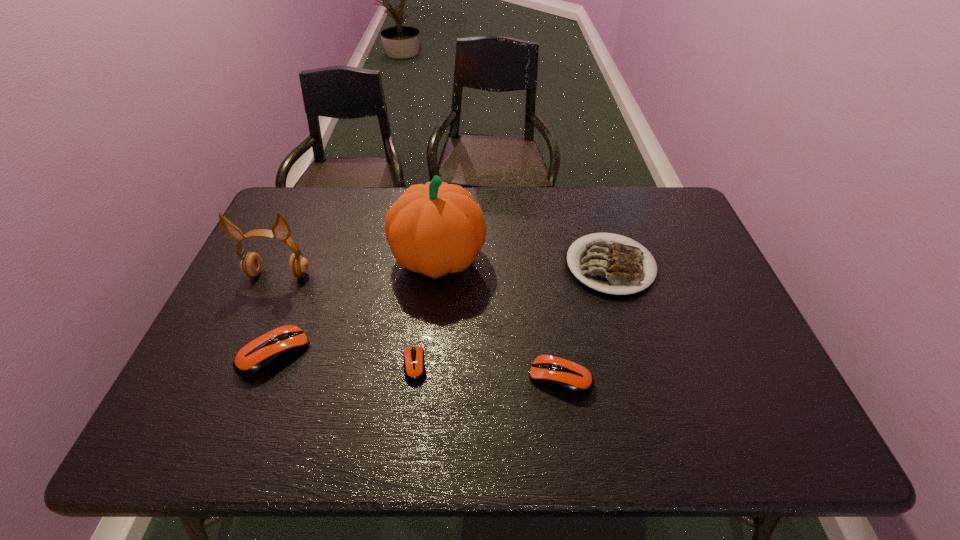
Where is `free space between the shortest computer mouse and the second shortest computer mouse`? Image resolution: width=960 pixels, height=540 pixels. free space between the shortest computer mouse and the second shortest computer mouse is located at coordinates (488, 371).

The image size is (960, 540). I want to click on free space between the pumpkin and the shortest computer mouse, so click(x=426, y=312).

This screenshot has width=960, height=540. Identify the location of free space between the shortest computer mouse and the leftmost computer mouse. (345, 359).

Locate which object ranks fourth in proximity to the second tallest computer mouse. Please provide its 2D coordinates. Your answer should be formatted as a tuple, i.e. [(x, y)], where the tuple contains the x and y coordinates of a point satisfying the conditions above.

[(260, 356)]

Find the location of `the closest object relative to the leftmost computer mouse`. the closest object relative to the leftmost computer mouse is located at coordinates (251, 264).

Find the location of a particular element. This screenshot has width=960, height=540. computer mouse identified as the second closest to the shortest computer mouse is located at coordinates (568, 377).

Choose which computer mouse is the second nearest neighbor to the plate. Please provide its 2D coordinates. Your answer should be formatted as a tuple, i.e. [(x, y)], where the tuple contains the x and y coordinates of a point satisfying the conditions above.

[(414, 365)]

I want to click on vacant position in the image that satisfies the following two spatial constraints: 1. on the front-facing side of the leftmost computer mouse; 2. on the left side of the second tallest object, so click(x=244, y=353).

Where is `vacant point that satisfies the following two spatial constraints: 1. on the front-facing side of the rightmost computer mouse; 2. on the right side of the earphone`? This screenshot has height=540, width=960. vacant point that satisfies the following two spatial constraints: 1. on the front-facing side of the rightmost computer mouse; 2. on the right side of the earphone is located at coordinates (233, 377).